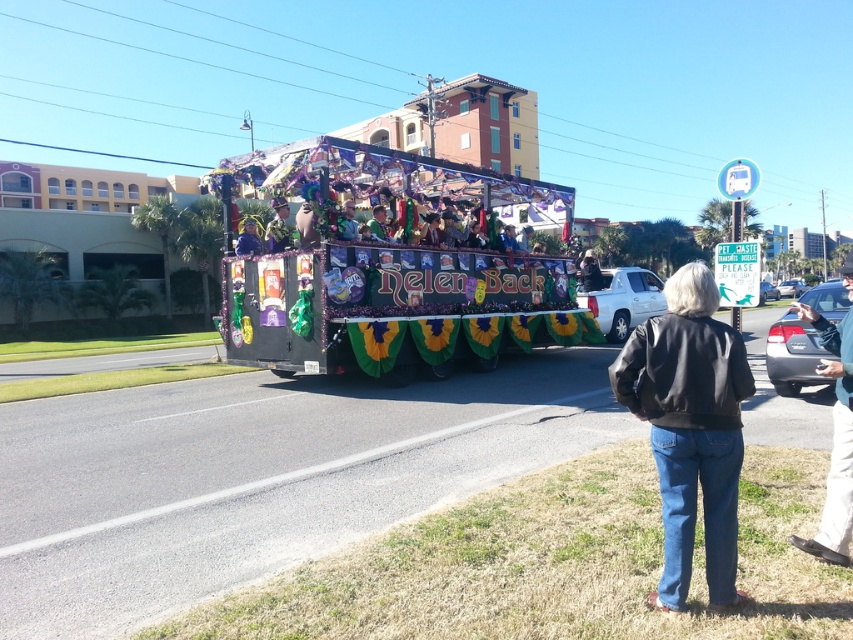
Based on the photo, you are a photographer trying to capture the blue fabric at center and the khaki pants at lower right in the same frame. Based on their positions, which object should you focus on first to ensure both are in the shot?

The khaki pants at lower right is below the blue fabric at center, so you should focus on the blue fabric at center first to ensure both are in the shot.

You are a photographer trying to capture the festive float in the center of the image. You notice the black leather jacket at lower right and the khaki pants at lower right in your frame. Which clothing item should you adjust your focus to ensure the float remains the main subject?

The black leather jacket at lower right is located below khaki pants at lower right. To keep the float as the main subject, focus on the float itself, as the jacket and pants are part of the foreground observer and not the central attraction.

You are a photographer trying to capture the festive float in the center of the image. There are two elements blocking your view slightly. One is the black leather jacket at lower right and the other is the blue fabric at center. Which of these two elements is closer to the right edge of the frame?

The black leather jacket at lower right is positioned on the right side of the blue fabric at center, meaning it is closer to the right edge of the frame than the blue fabric at center.